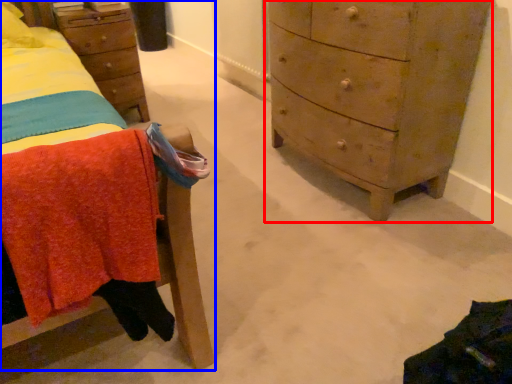
Question: Which of the following is the closest to the observer, chest of drawers (highlighted by a red box) or furniture (highlighted by a blue box)?

Choices:
 (A) chest of drawers
 (B) furniture

Answer: (B)